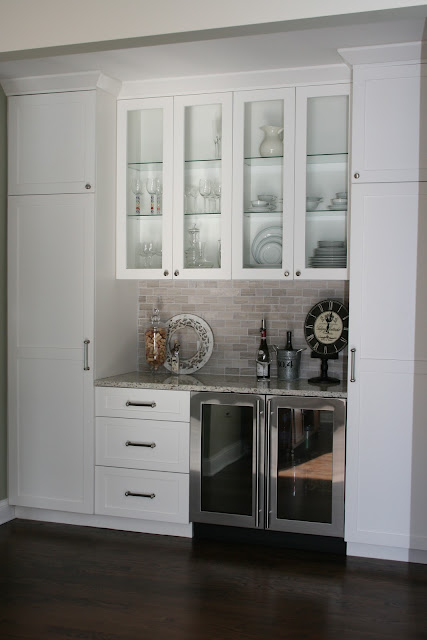
Identify the location of fridge left door. (x=196, y=415).